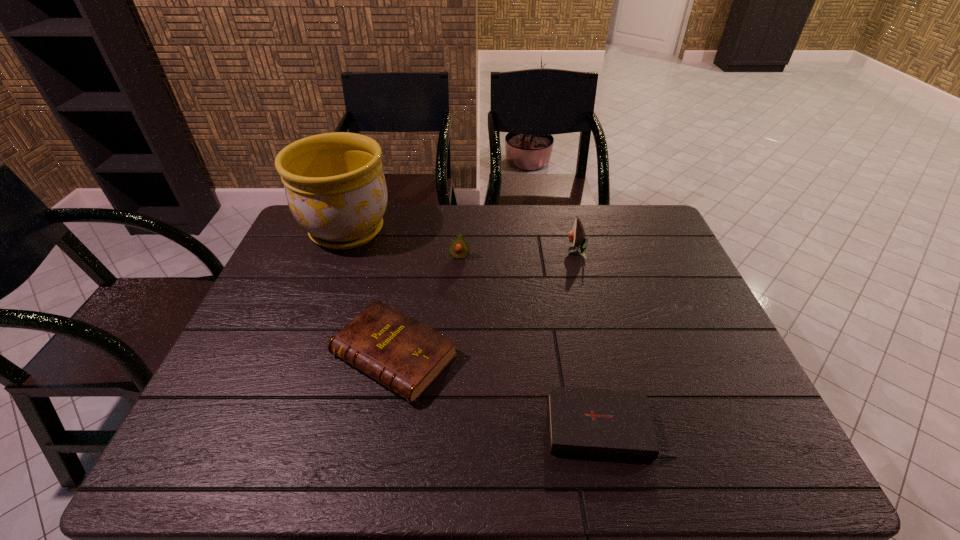
Locate an element on the screen. empty space between the fourth tallest object and the flowerpot is located at coordinates (371, 293).

Locate an element on the screen. The image size is (960, 540). vacant space that's between the shorter avocado and the shortest object is located at coordinates (534, 342).

At what (x,y) coordinates should I click in order to perform the action: click on unoccupied position between the Bible and the tallest object. Please return your answer as a coordinate pair (x, y). The height and width of the screenshot is (540, 960). Looking at the image, I should click on (477, 329).

The image size is (960, 540). Identify the location of free space between the fourth tallest object and the shorter avocado. (426, 306).

I want to click on vacant area between the shortest object and the right avocado, so click(591, 340).

You are a GUI agent. You are given a task and a screenshot of the screen. Output one action in this format:
    pyautogui.click(x=<x>, y=<y>)
    Task: Click on the third closest object to the taller avocado
    The width and height of the screenshot is (960, 540).
    Given the screenshot: What is the action you would take?
    click(x=603, y=423)

Identify the location of object that can be found as the fourth closest to the tallest object. (603, 423).

At what (x,y) coordinates should I click in order to perform the action: click on blank area in the image that satisfies the following two spatial constraints: 1. on the seed side of the second tallest object; 2. on the cut side of the third shortest object. Please return your answer as a coordinate pair (x, y). This screenshot has width=960, height=540. Looking at the image, I should click on (577, 257).

Find the location of a particular element. The image size is (960, 540). vacant space that satisfies the following two spatial constraints: 1. on the front side of the fourth tallest object; 2. on the right side of the Bible is located at coordinates (381, 428).